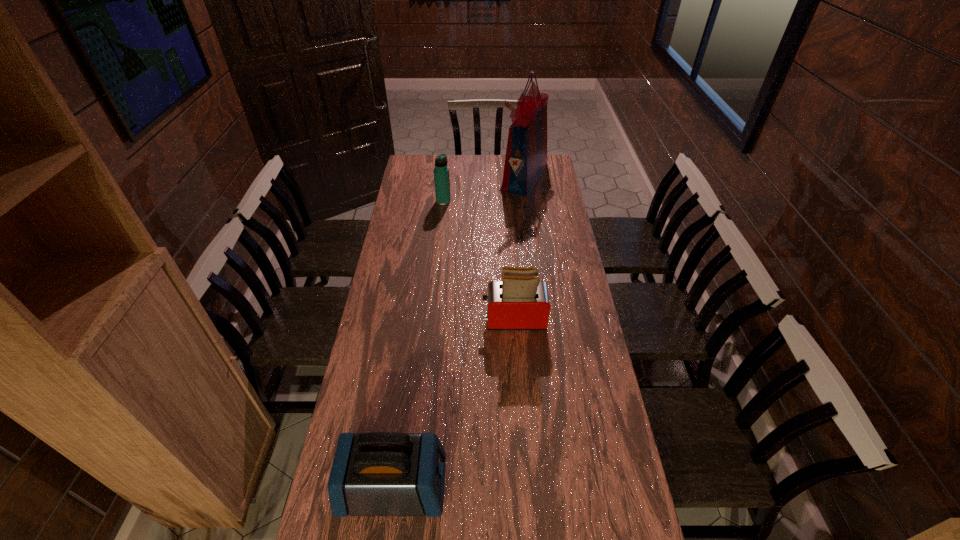
This screenshot has width=960, height=540. I want to click on free spot located 0.070m on the back of the thermos bottle, so click(444, 189).

The width and height of the screenshot is (960, 540). Identify the location of free location located 0.360m on the front-facing side of the farther toaster. (381, 319).

Image resolution: width=960 pixels, height=540 pixels. Find the location of `vacant space located 0.070m on the front-facing side of the farther toaster`. vacant space located 0.070m on the front-facing side of the farther toaster is located at coordinates (463, 319).

Find the location of a particular element. This screenshot has width=960, height=540. blank space located 0.390m on the front-facing side of the farther toaster is located at coordinates (372, 319).

Locate an element on the screen. vacant space located on the front-facing side of the left toaster is located at coordinates [545, 487].

I want to click on object present at the far edge, so click(526, 155).

Identify the location of object that is positioned at the left edge. pos(380,473).

The width and height of the screenshot is (960, 540). What are the coordinates of `grocery bag present at the right edge` in the screenshot? It's located at (526, 155).

This screenshot has width=960, height=540. What are the coordinates of `toaster present at the right edge` in the screenshot? It's located at (520, 301).

Where is `object that is at the far right corner`? object that is at the far right corner is located at coordinates (526, 155).